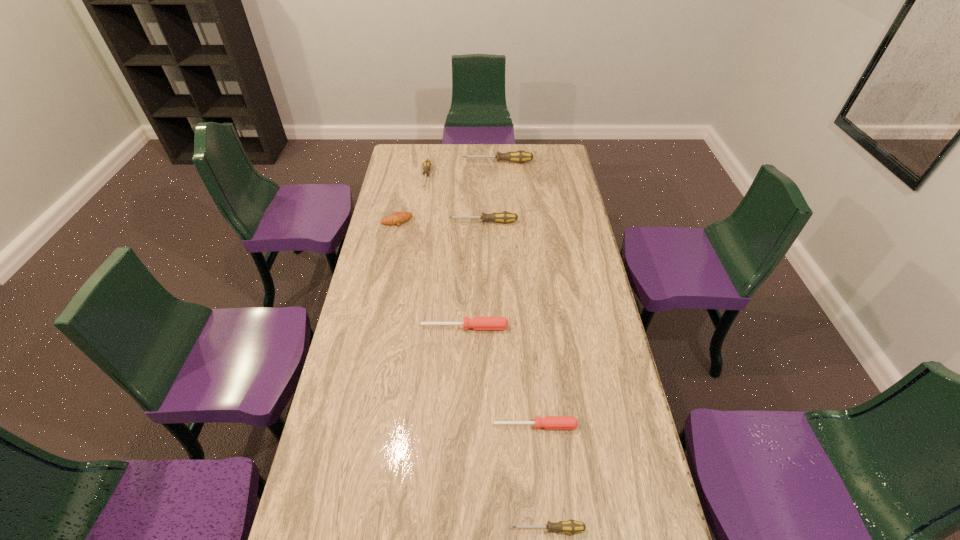
This screenshot has height=540, width=960. I want to click on blank space located on the back of the crescent roll, so click(x=402, y=194).

Image resolution: width=960 pixels, height=540 pixels. I want to click on vacant space situated on the right of the farther red screwdriver, so click(x=581, y=327).

Locate an element on the screen. The image size is (960, 540). vacant region located on the front of the nearer red screwdriver is located at coordinates (543, 511).

This screenshot has height=540, width=960. Find the location of `vacant space located 0.080m at the tip of the nearest gray screwdriver`. vacant space located 0.080m at the tip of the nearest gray screwdriver is located at coordinates (479, 529).

Identify the location of vacant area situated 0.150m at the tip of the nearest gray screwdriver. This screenshot has width=960, height=540. (451, 529).

Locate an element on the screen. This screenshot has height=540, width=960. vacant space located 0.330m at the tip of the nearest gray screwdriver is located at coordinates (378, 529).

Locate an element on the screen. The image size is (960, 540). screwdriver at the left edge is located at coordinates (427, 163).

Find the location of a particular element. Image resolution: width=960 pixels, height=540 pixels. crescent roll that is positioned at the left edge is located at coordinates (397, 218).

Where is `object that is at the far left corner`? object that is at the far left corner is located at coordinates (427, 163).

Identify the location of vacant space at the left edge. The width and height of the screenshot is (960, 540). (397, 252).